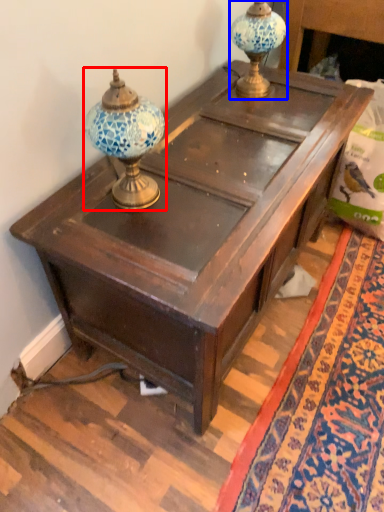
Question: Which point is closer to the camera, candle holder (highlighted by a red box) or candle holder (highlighted by a blue box)?

Choices:
 (A) candle holder
 (B) candle holder

Answer: (A)